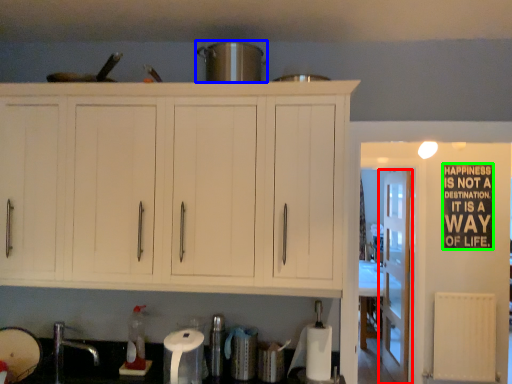
Question: Considering the real-world distances, which object is farthest from door (highlighted by a red box)? appliance (highlighted by a blue box) or bulletin board (highlighted by a green box)?

Choices:
 (A) appliance
 (B) bulletin board

Answer: (A)